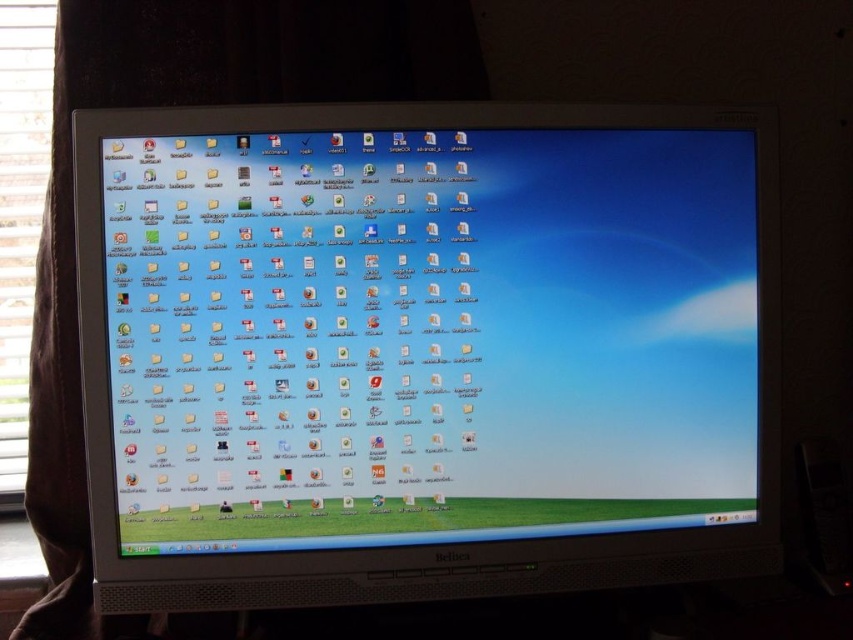
Question: From the image, what is the correct spatial relationship of white glossy monitor at center in relation to white wood window at left?

Choices:
 (A) left
 (B) right

Answer: (B)

Question: Can you confirm if white glossy monitor at center is wider than white wood window at left?

Choices:
 (A) no
 (B) yes

Answer: (B)

Question: Does white glossy monitor at center come in front of white wood window at left?

Choices:
 (A) yes
 (B) no

Answer: (A)

Question: Which object is closer to the camera taking this photo?

Choices:
 (A) white wood window at left
 (B) white glossy monitor at center

Answer: (B)